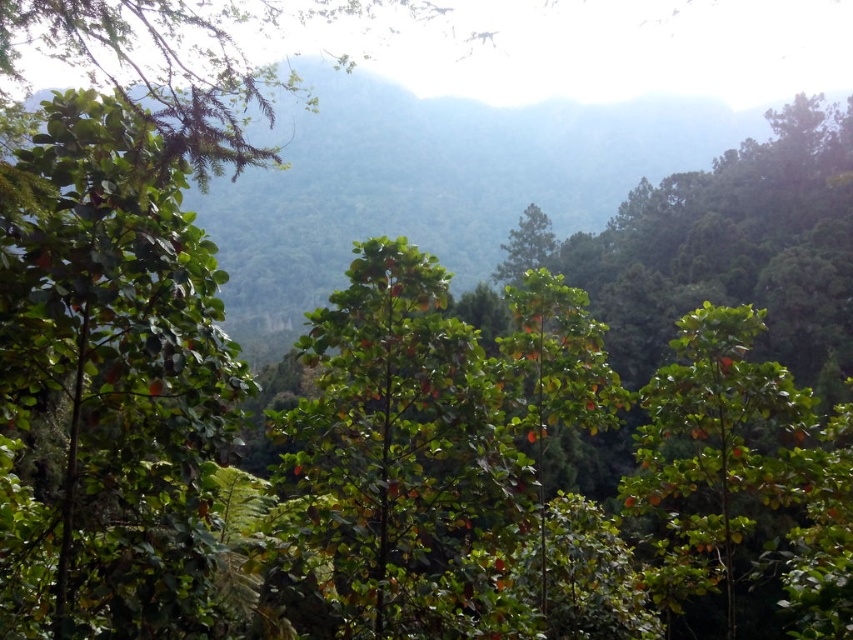
You are standing in the forest scene described. There is a point at coordinates (109, 387). What object is located at this point?

The point at coordinates (109, 387) corresponds to the green matte tree at left.

In the scene shown: You are standing in the forest scene described. You need to locate the green matte tree at left. Based on its coordinates, where would you find it in the image?

The green matte tree at left is located at coordinates point (109, 387), which places it in the lower left quadrant of the image.